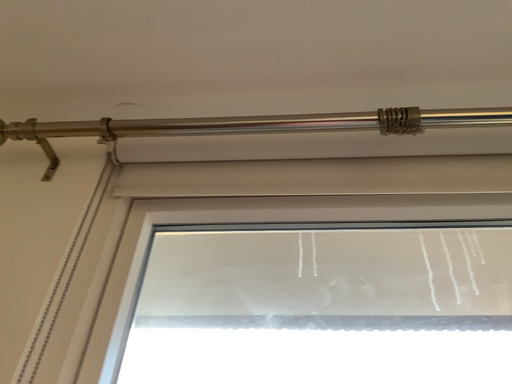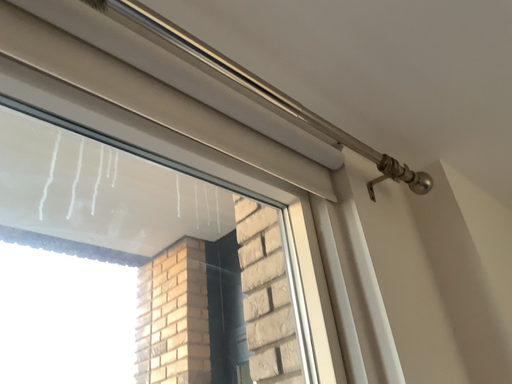
Question: How did the camera likely rotate when shooting the video?

Choices:
 (A) rotated downward
 (B) rotated upward

Answer: (A)